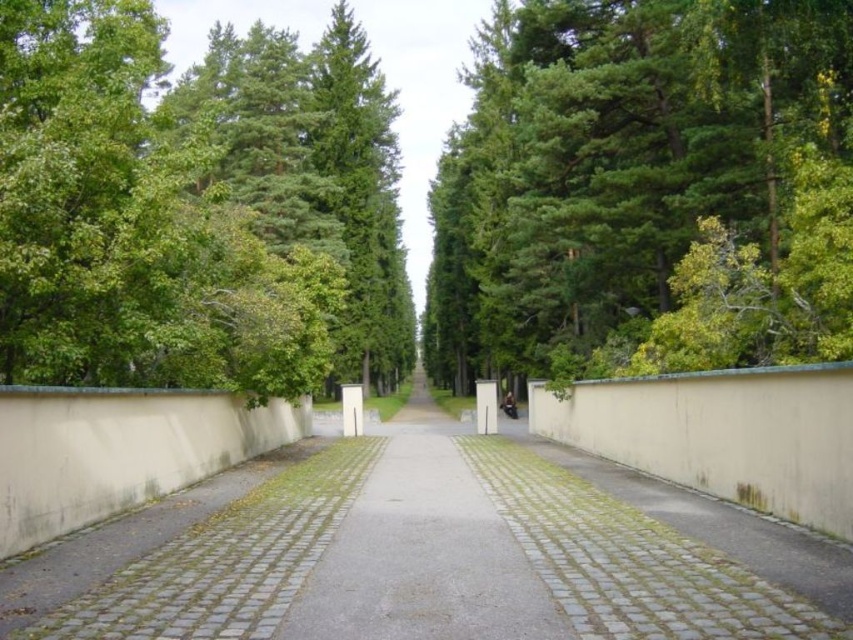
Question: Does green leafy tree at left lie behind gray cobblestone pavement at center?

Choices:
 (A) no
 (B) yes

Answer: (B)

Question: Estimate the real-world distances between objects in this image. Which object is closer to the green leafy tree at center?

Choices:
 (A) green leafy tree at left
 (B) beige concrete pavement at center

Answer: (A)

Question: Is green leafy tree at left smaller than gray cobblestone pavement at center?

Choices:
 (A) no
 (B) yes

Answer: (A)

Question: Is green leafy tree at left thinner than gray cobblestone pavement at center?

Choices:
 (A) no
 (B) yes

Answer: (A)

Question: Among these objects, which one is farthest from the camera?

Choices:
 (A) green leafy tree at left
 (B) green leafy tree at center
 (C) gray cobblestone pavement at center
 (D) beige concrete pavement at center

Answer: (B)

Question: Among these objects, which one is nearest to the camera?

Choices:
 (A) green leafy tree at center
 (B) green leafy tree at left
 (C) gray cobblestone pavement at center
 (D) beige concrete pavement at center

Answer: (D)